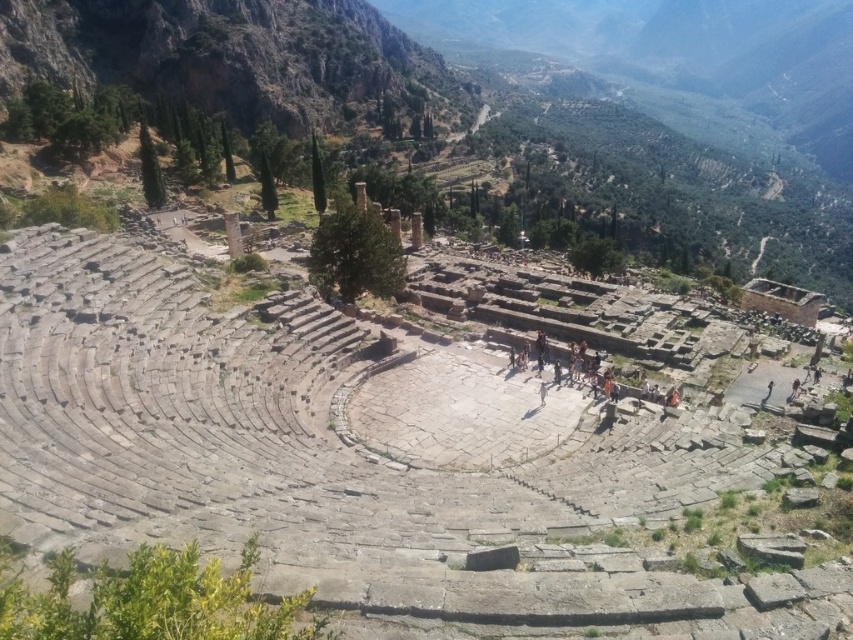
Consider the image. Who is positioned more to the right, rugged stone mountain at upper left or orange fabric people at center?

orange fabric people at center

Which of these two, rugged stone mountain at upper left or orange fabric people at center, stands shorter?

With less height is orange fabric people at center.

Between point (234, 92) and point (508, 337), which one is positioned behind?

Positioned behind is point (234, 92).

Identify the location of rugged stone mountain at upper left. The height and width of the screenshot is (640, 853). (230, 54).